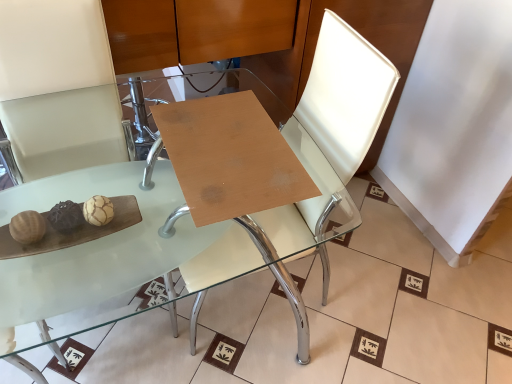
What do you see at coordinates (230, 157) in the screenshot? I see `wooden at center, the 1th table in the back-to-front sequence` at bounding box center [230, 157].

Describe the element at coordinates (331, 138) in the screenshot. I see `white leather swivel chair at center` at that location.

Locate an element on the screen. This screenshot has width=512, height=384. wooden at center, acting as the 2th table starting from the front is located at coordinates (230, 157).

Is transparent glass table at center, which ranks as the 2th table in back-to-front order, oriented towards wooden at center, the 1th table in the back-to-front sequence?

No.

Looking at this image, is transparent glass table at center, marked as the first table in a front-to-back arrangement, far away from wooden at center, the 1th table in the back-to-front sequence?

No, transparent glass table at center, marked as the first table in a front-to-back arrangement, is not far from wooden at center, the 1th table in the back-to-front sequence.

From the image's perspective, does transparent glass table at center, which ranks as the 2th table in back-to-front order, appear higher than wooden at center, acting as the 2th table starting from the front?

No, from the image's perspective, transparent glass table at center, which ranks as the 2th table in back-to-front order, is not above wooden at center, acting as the 2th table starting from the front.

Between point (274, 258) and point (292, 202), which one is positioned in front?

Point (292, 202)

Which of these two, transparent glass table at center, which ranks as the 2th table in back-to-front order, or white leather swivel chair at center, is thinner?

With smaller width is white leather swivel chair at center.

Looking at the image, does transparent glass table at center, which ranks as the 2th table in back-to-front order, seem bigger or smaller compared to white leather swivel chair at center?

Clearly, transparent glass table at center, which ranks as the 2th table in back-to-front order, is larger in size than white leather swivel chair at center.

Between point (179, 258) and point (294, 210), which one is positioned behind?

Positioned behind is point (294, 210).

From a real-world perspective, who is located higher, transparent glass table at center, marked as the first table in a front-to-back arrangement, or white leather swivel chair at center?

white leather swivel chair at center is physically above.

Is the depth of white leather swivel chair at center greater than that of transparent glass table at center, which ranks as the 2th table in back-to-front order?

Yes, white leather swivel chair at center is further from the camera.

From a real-world perspective, which is physically above, white leather swivel chair at center or transparent glass table at center, marked as the first table in a front-to-back arrangement?

white leather swivel chair at center, from a real-world perspective.

Does point (343, 195) come closer to viewer compared to point (137, 226)?

No, (343, 195) is behind (137, 226).

Considering the relative positions of white leather swivel chair at center and transparent glass table at center, which ranks as the 2th table in back-to-front order, in the image provided, is white leather swivel chair at center to the left or to the right of transparent glass table at center, which ranks as the 2th table in back-to-front order,?

From the image, it's evident that white leather swivel chair at center is to the right of transparent glass table at center, which ranks as the 2th table in back-to-front order.

Does point (172, 142) come farther from viewer compared to point (211, 240)?

No.

Looking at the image, does wooden at center, acting as the 2th table starting from the front, seem bigger or smaller compared to transparent glass table at center, which ranks as the 2th table in back-to-front order?

In the image, wooden at center, acting as the 2th table starting from the front, appears to be smaller than transparent glass table at center, which ranks as the 2th table in back-to-front order.

Considering the relative sizes of wooden at center, acting as the 2th table starting from the front, and transparent glass table at center, marked as the first table in a front-to-back arrangement, in the image provided, is wooden at center, acting as the 2th table starting from the front, thinner than transparent glass table at center, marked as the first table in a front-to-back arrangement,?

Yes, wooden at center, acting as the 2th table starting from the front, is thinner than transparent glass table at center, marked as the first table in a front-to-back arrangement.

Can you tell me how much white leather swivel chair at center and wooden at center, the 1th table in the back-to-front sequence, differ in facing direction?

The angular difference between white leather swivel chair at center and wooden at center, the 1th table in the back-to-front sequence, is 90 degrees.

In the scene shown: Who is smaller, white leather swivel chair at center or wooden at center, the 1th table in the back-to-front sequence?

wooden at center, the 1th table in the back-to-front sequence.

From a real-world perspective, which is physically above, white leather swivel chair at center or wooden at center, acting as the 2th table starting from the front?

wooden at center, acting as the 2th table starting from the front.

Which object is closer to the camera, white leather swivel chair at center or wooden at center, the 1th table in the back-to-front sequence?

white leather swivel chair at center is more forward.

Is white leather swivel chair at center a part of wooden at center, acting as the 2th table starting from the front?

No, white leather swivel chair at center is not surrounded by wooden at center, acting as the 2th table starting from the front.

Is wooden at center, acting as the 2th table starting from the front, to the left of white leather swivel chair at center from the viewer's perspective?

Yes, wooden at center, acting as the 2th table starting from the front, is to the left of white leather swivel chair at center.

From a real-world perspective, relative to white leather swivel chair at center, is wooden at center, acting as the 2th table starting from the front, vertically above or below?

Clearly, from a real-world perspective, wooden at center, acting as the 2th table starting from the front, is above white leather swivel chair at center.

Is wooden at center, acting as the 2th table starting from the front, facing away from white leather swivel chair at center?

Yes, wooden at center, acting as the 2th table starting from the front, is facing away from white leather swivel chair at center.

At what (x,y) coordinates should I click in order to perform the action: click on table behind the transparent glass table at center, which ranks as the 2th table in back-to-front order. Please return your answer as a coordinate pair (x, y). Looking at the image, I should click on (230, 157).

What are the coordinates of `swivel chair above the transparent glass table at center, which ranks as the 2th table in back-to-front order (from the image's perspective)` in the screenshot? It's located at (331, 138).

Consider the image. From the image, which object appears to be farther from transparent glass table at center, which ranks as the 2th table in back-to-front order, wooden at center, the 1th table in the back-to-front sequence, or white leather swivel chair at center?

wooden at center, the 1th table in the back-to-front sequence.

Which object lies nearer to the anchor point transparent glass table at center, marked as the first table in a front-to-back arrangement, white leather swivel chair at center or wooden at center, acting as the 2th table starting from the front?

Based on the image, white leather swivel chair at center appears to be nearer to transparent glass table at center, marked as the first table in a front-to-back arrangement.

Which object lies nearer to the anchor point white leather swivel chair at center, transparent glass table at center, marked as the first table in a front-to-back arrangement, or wooden at center, acting as the 2th table starting from the front?

Based on the image, transparent glass table at center, marked as the first table in a front-to-back arrangement, appears to be nearer to white leather swivel chair at center.

Based on their spatial positions, is transparent glass table at center, marked as the first table in a front-to-back arrangement, or white leather swivel chair at center further from wooden at center, acting as the 2th table starting from the front?

Among the two, white leather swivel chair at center is located further to wooden at center, acting as the 2th table starting from the front.

Considering their positions, is wooden at center, the 1th table in the back-to-front sequence, positioned closer to white leather swivel chair at center than transparent glass table at center, marked as the first table in a front-to-back arrangement?

The object closer to white leather swivel chair at center is transparent glass table at center, marked as the first table in a front-to-back arrangement.

Based on their spatial positions, is white leather swivel chair at center or transparent glass table at center, which ranks as the 2th table in back-to-front order, further from wooden at center, the 1th table in the back-to-front sequence?

white leather swivel chair at center.

Where is `table between transparent glass table at center, which ranks as the 2th table in back-to-front order, and white leather swivel chair at center from left to right`? The image size is (512, 384). table between transparent glass table at center, which ranks as the 2th table in back-to-front order, and white leather swivel chair at center from left to right is located at coordinates (230, 157).